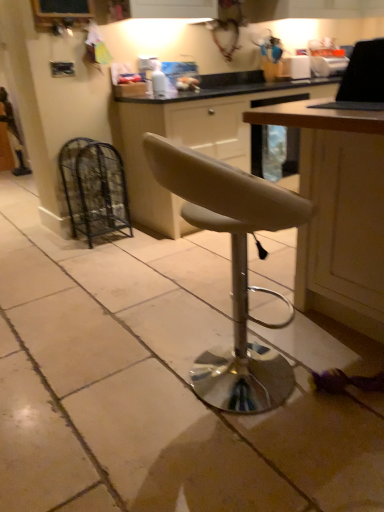
Locate an element on the screen. The height and width of the screenshot is (512, 384). free area below beige leather stool at center (from a real-world perspective) is located at coordinates (234, 400).